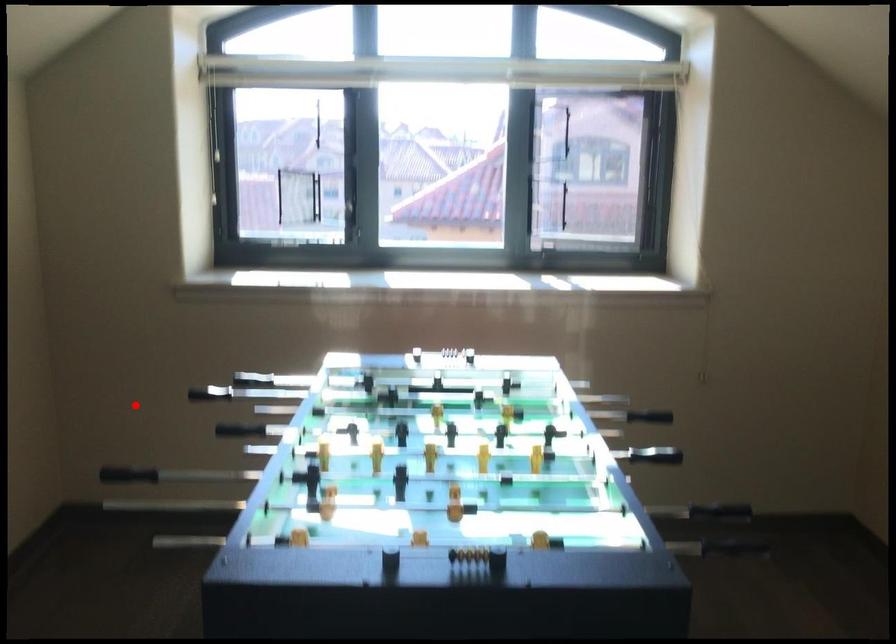
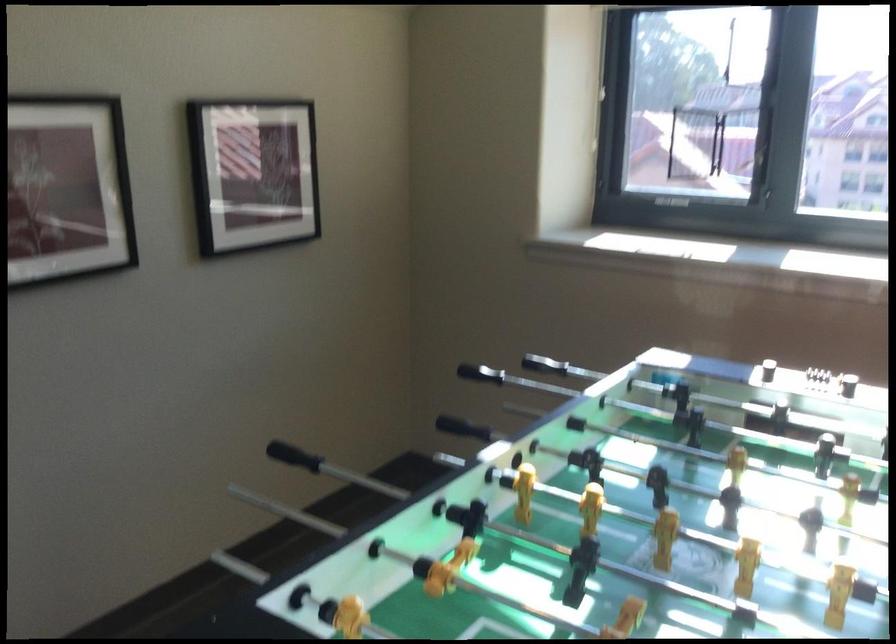
Locate, in the second image, the point that corresponds to the highlighted location in the first image.

(479, 373)